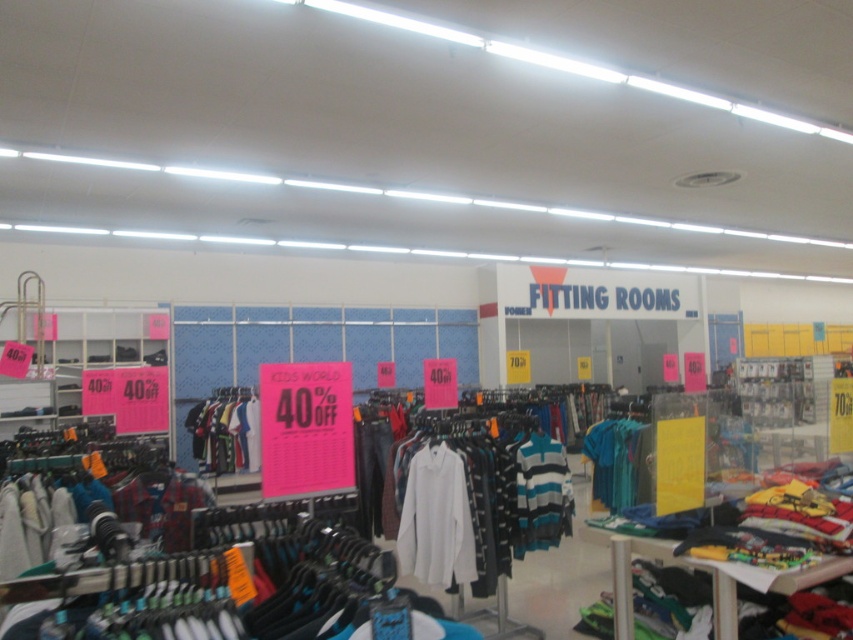
You are a customer in the store and want to find the white cotton shirt at center. According to the store layout, where should you look relative to the entrance?

The white cotton shirt at center is located at the coordinates (436, 518) in the store layout, which is near the center of the store. Since the entrance is typically at the front, you should look towards the middle area of the store to find it.

You are a customer in the store and want to know which shirt takes up more space on the rack. Which one is wider between the white cotton shirt at center and the striped cotton shirt at center?

The striped cotton shirt at center is wider than the white cotton shirt at center, so it takes up more space on the rack.